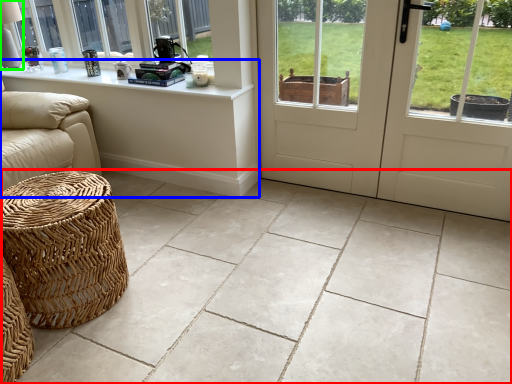
Question: Estimate the real-world distances between objects in this image. Which object is farther from ceramic tile (highlighted by a red box), table (highlighted by a blue box) or table lamp (highlighted by a green box)?

Choices:
 (A) table
 (B) table lamp

Answer: (B)